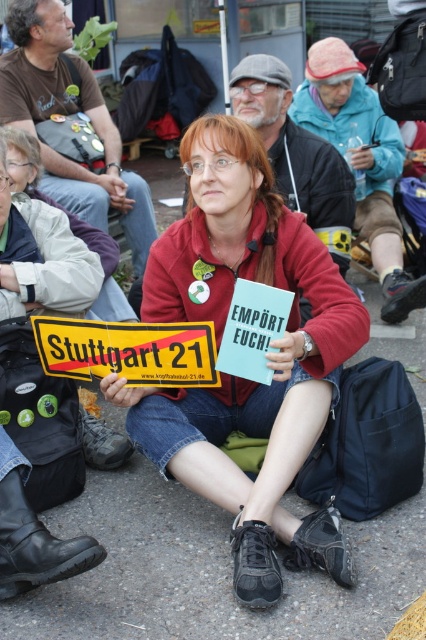
You are a photographer trying to capture the central figure in the image. If you want to focus on the matte red jacket at center, where should you aim your camera? Please provide coordinates in the format of a point like this example format point 0.558, 0.627.

Result: The matte red jacket at center is located at point (267, 356), so you should aim your camera at that coordinate to focus on it.